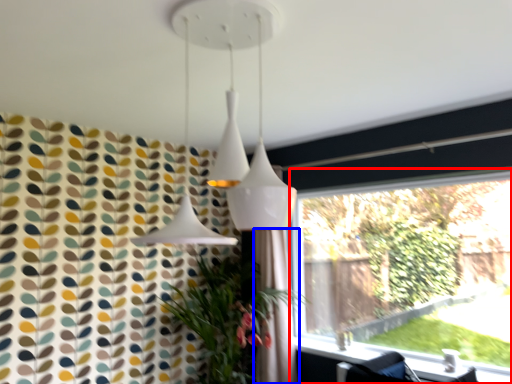
Question: Which object is closer to the camera taking this photo, window (highlighted by a red box) or shower curtain (highlighted by a blue box)?

Choices:
 (A) window
 (B) shower curtain

Answer: (A)